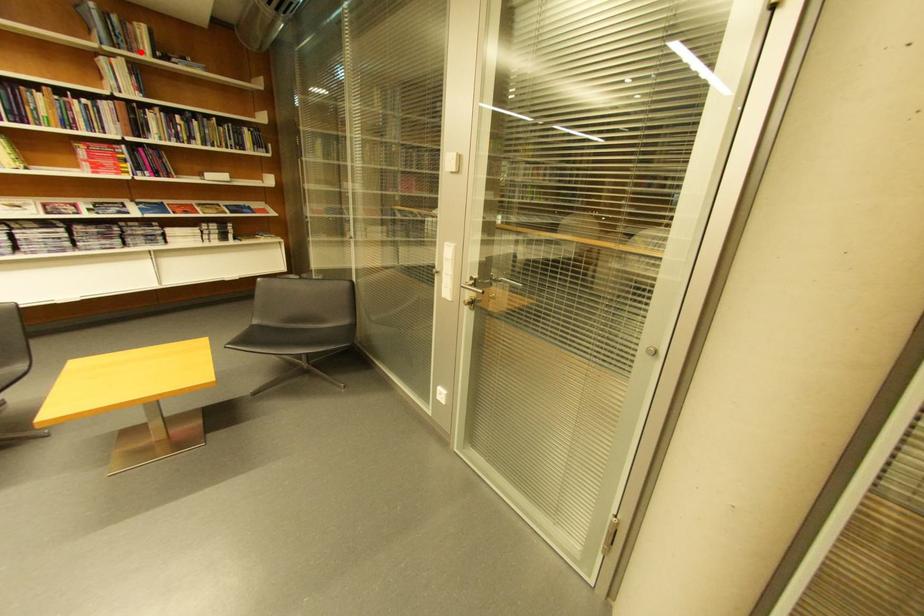
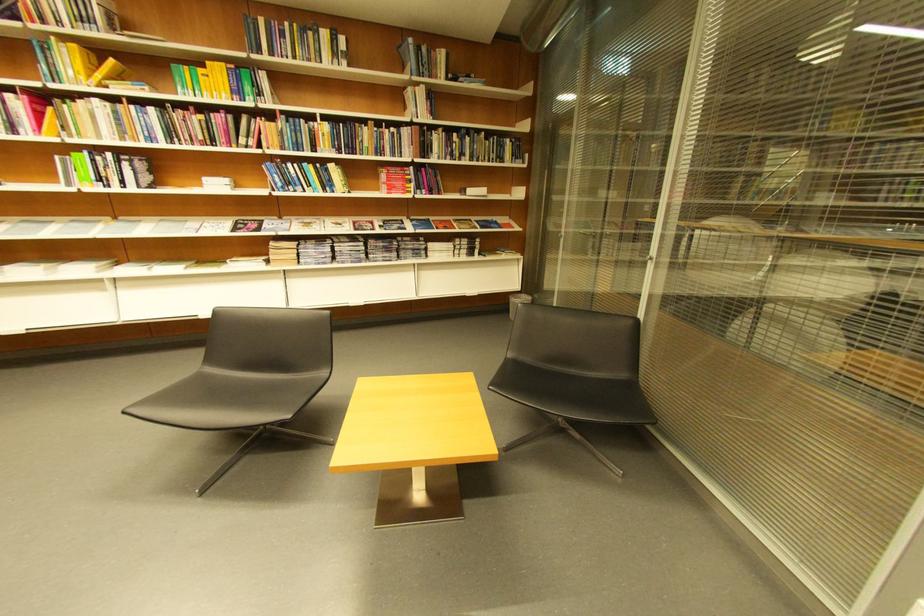
Where in the second image is the point corresponding to the highlighted location from the first image?

(441, 78)